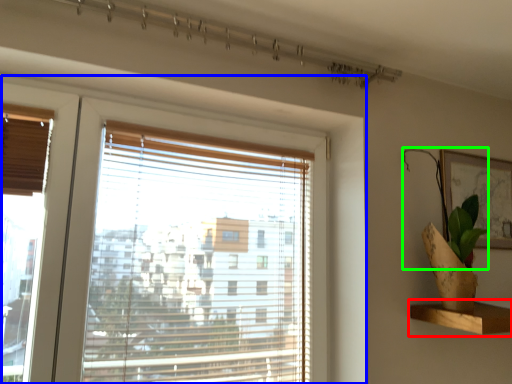
Question: Which object is the closest to the shelf (highlighted by a red box)? Choose among these: window (highlighted by a blue box) or plant (highlighted by a green box).

Choices:
 (A) window
 (B) plant

Answer: (B)